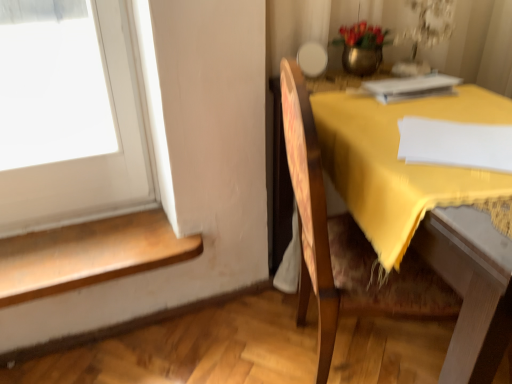
Identify the location of free space to the left of white paper at upper right. This screenshot has width=512, height=384. (342, 100).